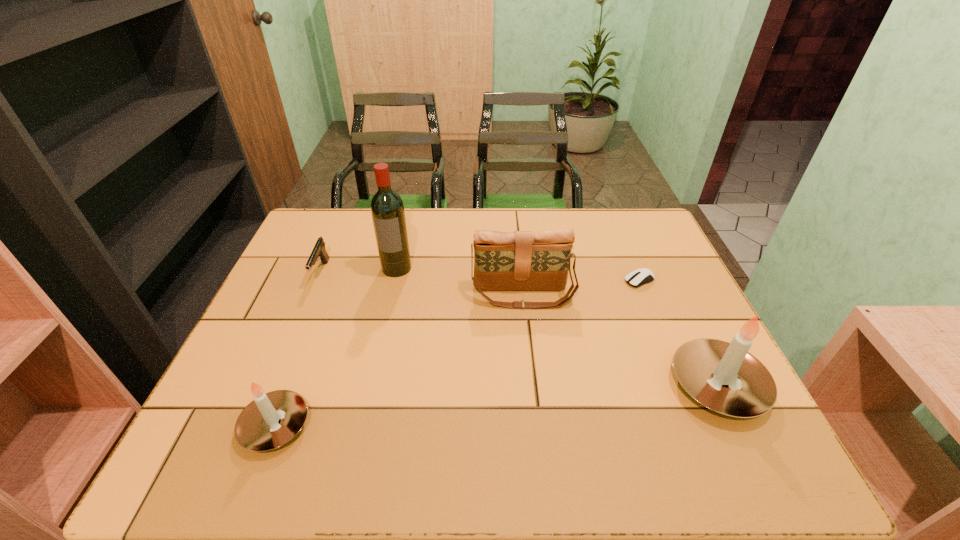
At what (x,y) coordinates should I click in order to perform the action: click on the left candle. Please return your answer as a coordinate pair (x, y). Looking at the image, I should click on (272, 419).

The width and height of the screenshot is (960, 540). Find the location of `the shorter candle`. the shorter candle is located at coordinates (272, 419).

At what (x,y) coordinates should I click in order to perform the action: click on the taller candle. Please return your answer as a coordinate pair (x, y). This screenshot has height=540, width=960. Looking at the image, I should click on [x=702, y=366].

The width and height of the screenshot is (960, 540). What are the coordinates of `pistol` in the screenshot? It's located at (319, 250).

Identify the location of the third tallest object. This screenshot has height=540, width=960. (503, 261).

I want to click on the fourth object from left to right, so click(503, 261).

At what (x,y) coordinates should I click in order to perform the action: click on mouse. Please return your answer as a coordinate pair (x, y). This screenshot has height=540, width=960. Looking at the image, I should click on (639, 277).

The image size is (960, 540). What are the coordinates of `wine bottle` in the screenshot? It's located at (388, 215).

Identify the location of the tallest object. The width and height of the screenshot is (960, 540). (388, 215).

Find the location of a particular element. blank area located 0.390m on the right of the third shortest object is located at coordinates (499, 426).